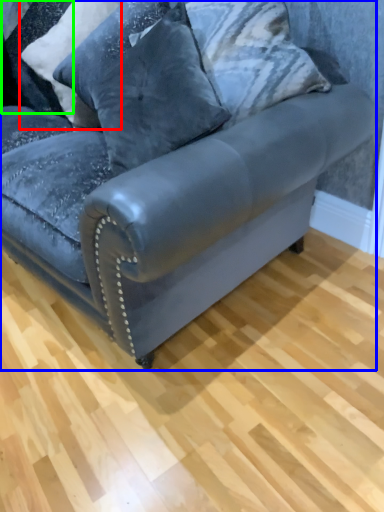
Question: Which object is positioned farthest from pillow (highlighted by a red box)? Select from studio couch (highlighted by a blue box) and pillow (highlighted by a green box).

Choices:
 (A) studio couch
 (B) pillow

Answer: (A)